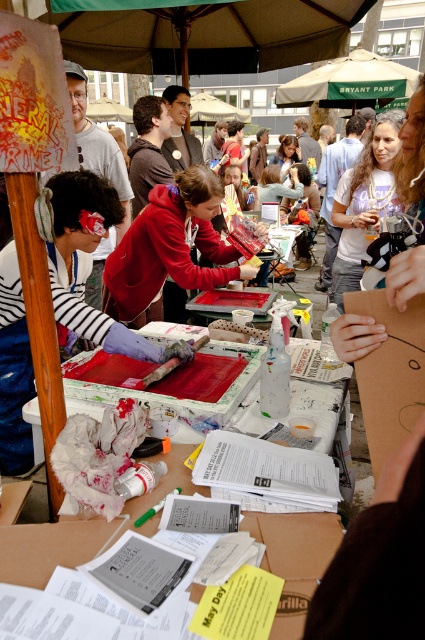
You are a participant at the event and want to place a heavy object on the red glossy table at center without obstructing the view of the smooth skin face at center. Is the table positioned in a way that allows this?

The red glossy table at center is in front of the smooth skin face at center, so placing a heavy object on the table might block their view. Consider placing the object on a different surface or ensure it doesn not obstruct the line of sight.

You are a photographer positioned at the event and want to take a photo that clearly shows both the red glossy table at center and the matte red hoodie at center. Which object will appear larger in the photo?

The red glossy table at center will appear larger in the photo because it is closer to the viewer than the matte red hoodie at center.